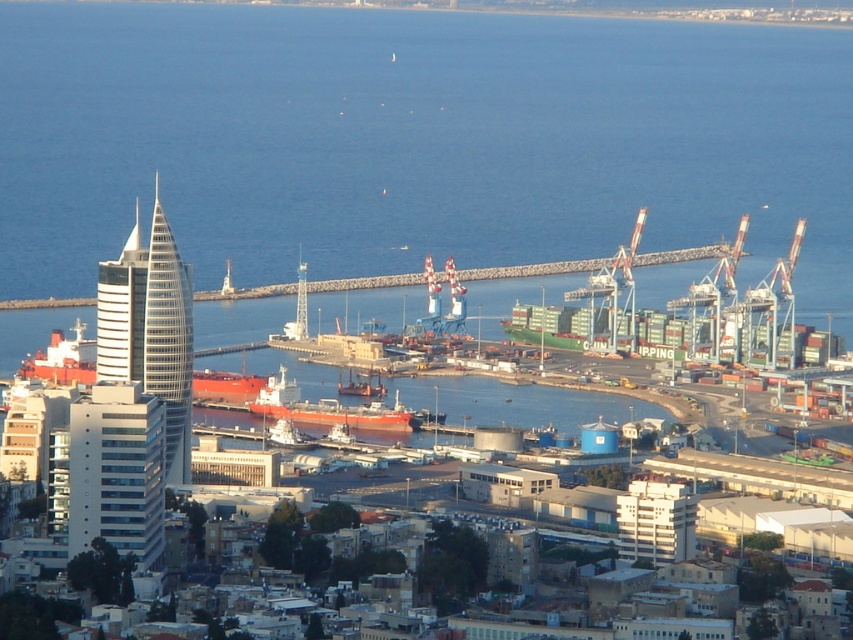
Which is above, blue water at center or matte orange ship at center?

Positioned higher is blue water at center.

Identify the location of blue water at center. The width and height of the screenshot is (853, 640). pyautogui.click(x=415, y=141).